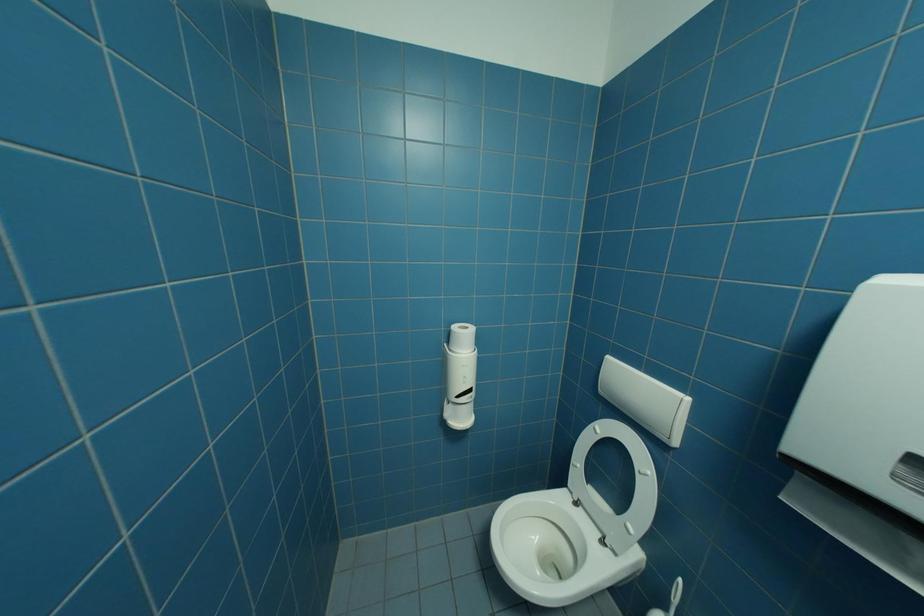
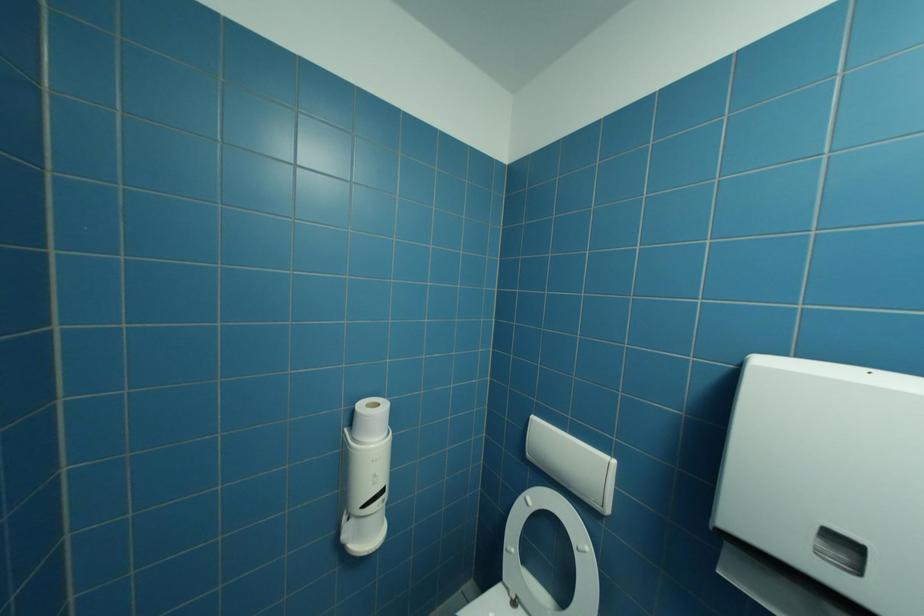
Question: Based on the continuous images, in which direction is the camera rotating? Reply with the corresponding letter.

Choices:
 (A) Left
 (B) Right
 (C) Up
 (D) Down

Answer: (B)